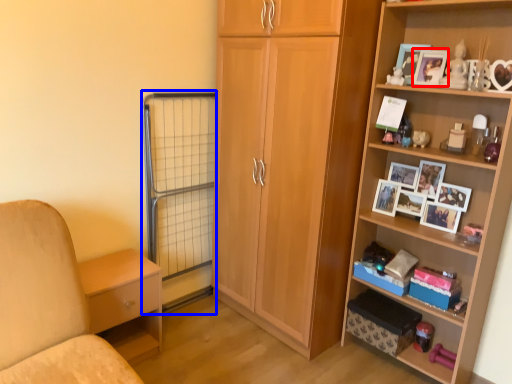
Question: Which object is further to the camera taking this photo, picture frame (highlighted by a red box) or screen door (highlighted by a blue box)?

Choices:
 (A) picture frame
 (B) screen door

Answer: (B)